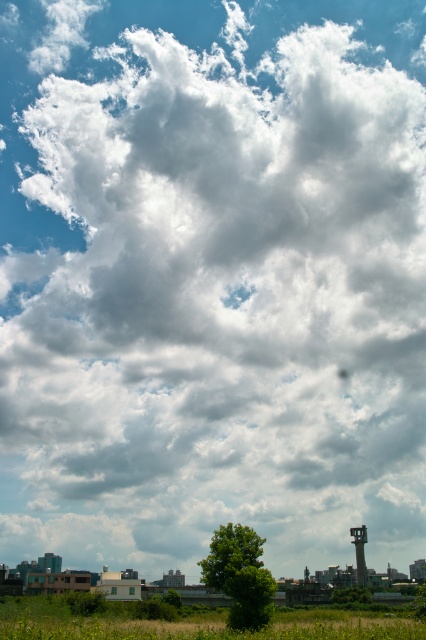
Can you confirm if green grass at lower center is positioned above green matte tree at lower center?

Indeed, green grass at lower center is positioned over green matte tree at lower center.

Does point (414, 637) lie in front of point (345, 592)?

Yes, it is.

Find the location of a particular element. This screenshot has width=426, height=640. green grass at lower center is located at coordinates (213, 627).

Does green leafy tree at center have a smaller size compared to green matte tree at lower center?

Yes, green leafy tree at center is smaller than green matte tree at lower center.

Between green leafy tree at center and green matte tree at lower center, which one appears on the left side from the viewer's perspective?

Positioned to the left is green leafy tree at center.

Is point (245, 540) positioned before point (336, 592)?

That is True.

This screenshot has width=426, height=640. What are the coordinates of `green leafy tree at center` in the screenshot? It's located at (239, 573).

Can you confirm if green grass at lower center is taller than green leafy tree at center?

Yes.

Is green grass at lower center further to the viewer compared to green leafy tree at center?

No, green grass at lower center is closer to the viewer.

What do you see at coordinates (213, 627) in the screenshot?
I see `green grass at lower center` at bounding box center [213, 627].

You are a GUI agent. You are given a task and a screenshot of the screen. Output one action in this format:
    pyautogui.click(x=<x>, y=<y>)
    Task: Click on the green grass at lower center
    
    Given the screenshot: What is the action you would take?
    pyautogui.click(x=213, y=627)